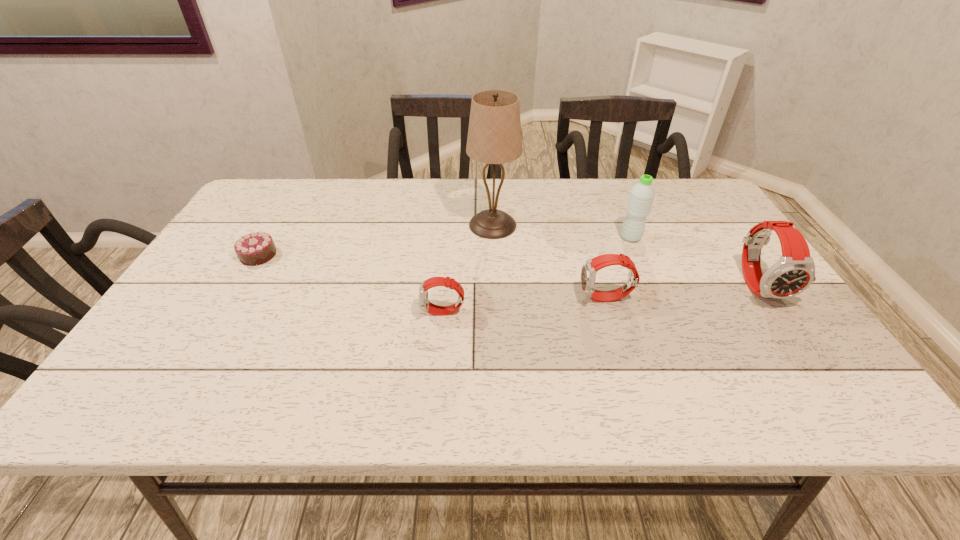
Find the location of `blank space located 0.160m on the face of the leftmost watch`. blank space located 0.160m on the face of the leftmost watch is located at coordinates (354, 313).

Identify the location of free space located on the face of the leftmost watch. (286, 313).

This screenshot has width=960, height=540. What are the coordinates of `blank area located 0.270m on the face of the leftmost watch` in the screenshot? It's located at (307, 313).

At what (x,y) coordinates should I click in order to perform the action: click on free point located 0.310m on the face of the second watch from left to right. Please return your answer as a coordinate pair (x, y). The height and width of the screenshot is (540, 960). Looking at the image, I should click on (452, 299).

Where is `vacant region located 0.200m on the face of the second watch from left to right`? Image resolution: width=960 pixels, height=540 pixels. vacant region located 0.200m on the face of the second watch from left to right is located at coordinates (497, 299).

Locate an element on the screen. vacant space situated 0.360m on the face of the second watch from left to right is located at coordinates (432, 299).

Image resolution: width=960 pixels, height=540 pixels. What are the coordinates of `free location located 0.150m on the face of the tallest watch` in the screenshot? It's located at (811, 362).

The width and height of the screenshot is (960, 540). I want to click on vacant region located on the front of the water bottle, so click(655, 294).

Where is `free space located on the back of the shortest object`? This screenshot has height=540, width=960. free space located on the back of the shortest object is located at coordinates (294, 194).

Locate an element on the screen. This screenshot has height=540, width=960. vacant region located 0.360m on the front-facing side of the lampshade is located at coordinates (345, 225).